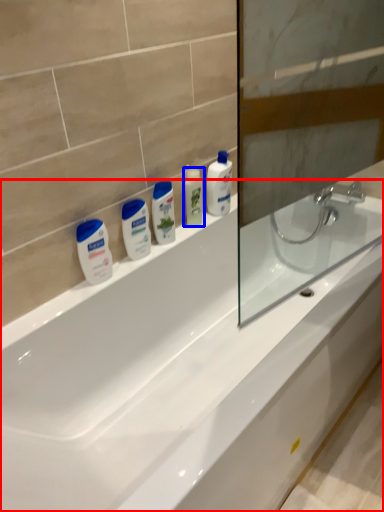
Question: Which object is further to the camera taking this photo, bathtub (highlighted by a red box) or mouthwash (highlighted by a blue box)?

Choices:
 (A) bathtub
 (B) mouthwash

Answer: (B)